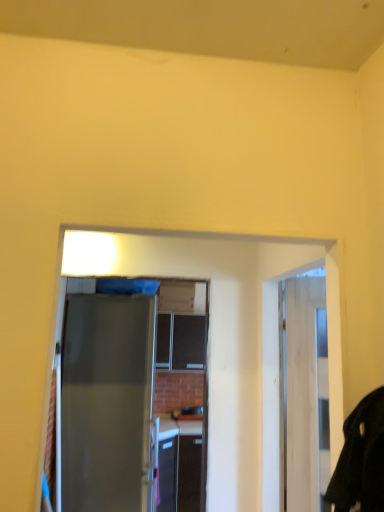
At what (x,y) coordinates should I click in order to perform the action: click on black matte robe at right. Please return your answer as a coordinate pair (x, y). Looking at the image, I should click on (361, 459).

This screenshot has width=384, height=512. Describe the element at coordinates (361, 459) in the screenshot. I see `black matte robe at right` at that location.

Measure the distance between black matte robe at right and camera.

black matte robe at right is 34.83 inches from camera.

Measure the distance between point (347, 453) and camera.

Point (347, 453) is 37.68 inches away from camera.

What do you see at coordinates (108, 399) in the screenshot? Image resolution: width=384 pixels, height=512 pixels. I see `satin gray door at center` at bounding box center [108, 399].

Locate an element on the screen. This screenshot has height=512, width=384. satin gray door at center is located at coordinates (108, 399).

What are the coordinates of `black matte robe at right` in the screenshot? It's located at (361, 459).

Does black matte robe at right appear on the left side of satin gray door at center?

In fact, black matte robe at right is to the right of satin gray door at center.

Is black matte robe at right positioned behind satin gray door at center?

No.

Considering the positions of points (362, 451) and (89, 497), is point (362, 451) farther from camera compared to point (89, 497)?

No.

From the image's perspective, which is above, black matte robe at right or satin gray door at center?

black matte robe at right.

From a real-world perspective, who is located higher, black matte robe at right or satin gray door at center?

black matte robe at right.

Is black matte robe at right thinner than satin gray door at center?

Yes.

Is black matte robe at right taller than satin gray door at center?

No.

Considering the sizes of objects black matte robe at right and satin gray door at center in the image provided, who is bigger, black matte robe at right or satin gray door at center?

satin gray door at center.

Which is correct: black matte robe at right is inside satin gray door at center, or outside of it?

The correct answer is: outside.

Is black matte robe at right touching satin gray door at center?

No.

Is black matte robe at right positioned with its back to satin gray door at center?

No, black matte robe at right is not facing the opposite direction of satin gray door at center.

The height and width of the screenshot is (512, 384). What are the coordinates of `door below the black matte robe at right (from the image's perspective)` in the screenshot? It's located at (108, 399).

Can you confirm if satin gray door at center is positioned to the right of black matte robe at right?

No, satin gray door at center is not to the right of black matte robe at right.

Relative to black matte robe at right, is satin gray door at center in front or behind?

Visually, satin gray door at center is located behind black matte robe at right.

Is point (149, 387) closer to viewer compared to point (344, 461)?

No.

From the image's perspective, is satin gray door at center located above black matte robe at right?

No, from the image's perspective, satin gray door at center is not on top of black matte robe at right.

From a real-world perspective, is satin gray door at center physically below black matte robe at right?

Correct, in the physical world, satin gray door at center is lower than black matte robe at right.

Between satin gray door at center and black matte robe at right, which one has smaller width?

With smaller width is black matte robe at right.

Considering the sizes of satin gray door at center and black matte robe at right in the image, is satin gray door at center taller or shorter than black matte robe at right?

satin gray door at center is taller than black matte robe at right.

Considering the relative sizes of satin gray door at center and black matte robe at right in the image provided, is satin gray door at center smaller than black matte robe at right?

Actually, satin gray door at center might be larger than black matte robe at right.

From the picture: Is satin gray door at center inside the boundaries of black matte robe at right, or outside?

satin gray door at center is outside black matte robe at right.

Is satin gray door at center not close to black matte robe at right?

Yes, satin gray door at center and black matte robe at right are quite far apart.

Could you tell me if satin gray door at center is turned towards black matte robe at right?

No, satin gray door at center is not facing towards black matte robe at right.

Where is `robe above the satin gray door at center (from a real-world perspective)`? The image size is (384, 512). robe above the satin gray door at center (from a real-world perspective) is located at coordinates (361, 459).

The image size is (384, 512). In order to click on robe in front of the satin gray door at center in this screenshot , I will do `click(361, 459)`.

Find the location of a particular element. The height and width of the screenshot is (512, 384). robe above the satin gray door at center (from the image's perspective) is located at coordinates (361, 459).